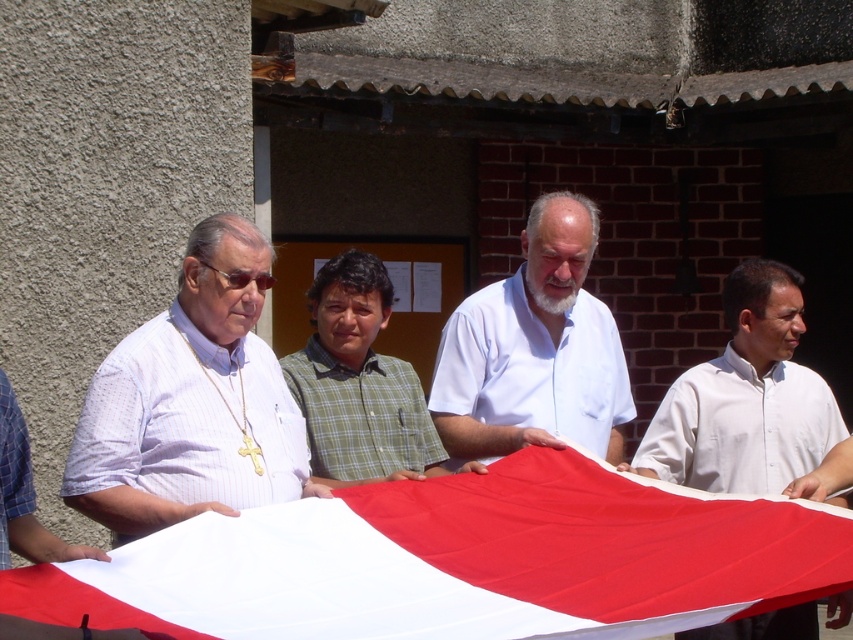
Based on the scene description, which man is positioned higher in the image between the white striped shirt at left and the green checkered shirt at center?

The white striped shirt at left is positioned higher than the green checkered shirt at center in the image.

You are a photographer positioned at the center of the scene. You need to capture a photo of the white fabric flag at center without any obstructions. Are there any men standing between you and the flag?

The white fabric flag at center is located at point (461,561), which is in the foreground and central position. Since the men are standing around the flag but the flag is at the center foreground, there are no men directly between the photographer and the flag, so it can be captured without obstructions.